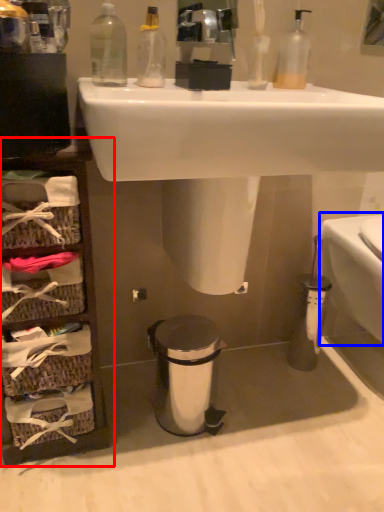
Question: Which object is further to the camera taking this photo, cabinet (highlighted by a red box) or toilet bowl (highlighted by a blue box)?

Choices:
 (A) cabinet
 (B) toilet bowl

Answer: (B)